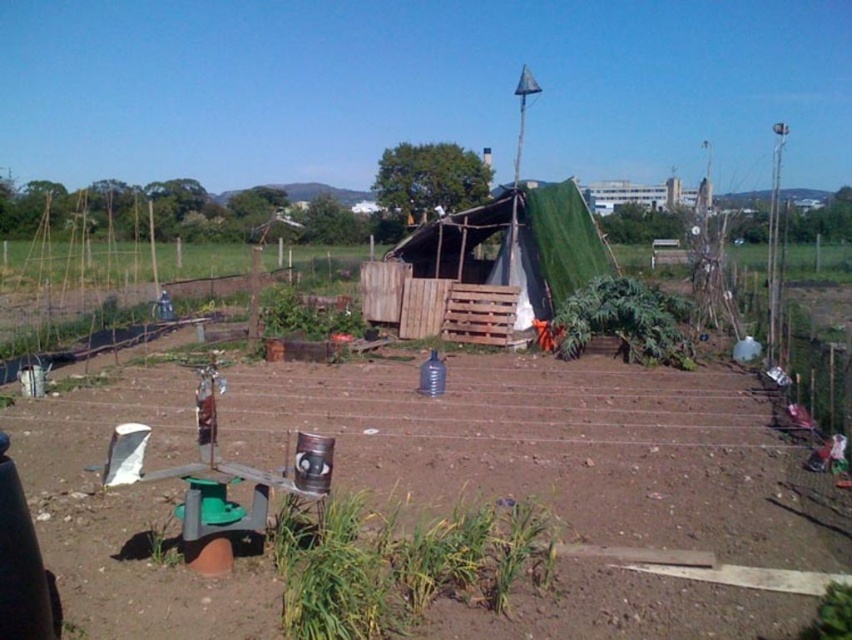
You are a gardener who wants to plant some flowers in the brown soil at center. You need to move the green tarpaulin tent at center to access the soil. Is the soil to the left or right of the tent?

The brown soil at center is positioned on the left side of green tarpaulin tent at center, so the soil is to the left of the tent.

In the scene shown: You are a gardener who wants to water the brown soil at center. The green tarpaulin tent at center is blocking the sunlight. Should you remove the tent to let sunlight reach the soil?

The brown soil at center is positioned under green tarpaulin tent at center, so removing the tent would allow sunlight to reach the soil.

From the picture: You are a gardener who wants to plant a sunflower seed that requires 1 meter of vertical space to grow. Looking at the brown soil at center and the green tarpaulin tent at center, which object is shorter and can the sunflower grow there without hitting the tent?

The brown soil at center is shorter than the green tarpaulin tent at center. Since the sunflower needs 1 meter of vertical space and the soil is shorter than the tent, the sunflower can grow there as long as the tent is taller than 1 meter. However, without knowing the exact height of the tent, we cannot confirm if there is enough space. Please measure the tent height before planting.